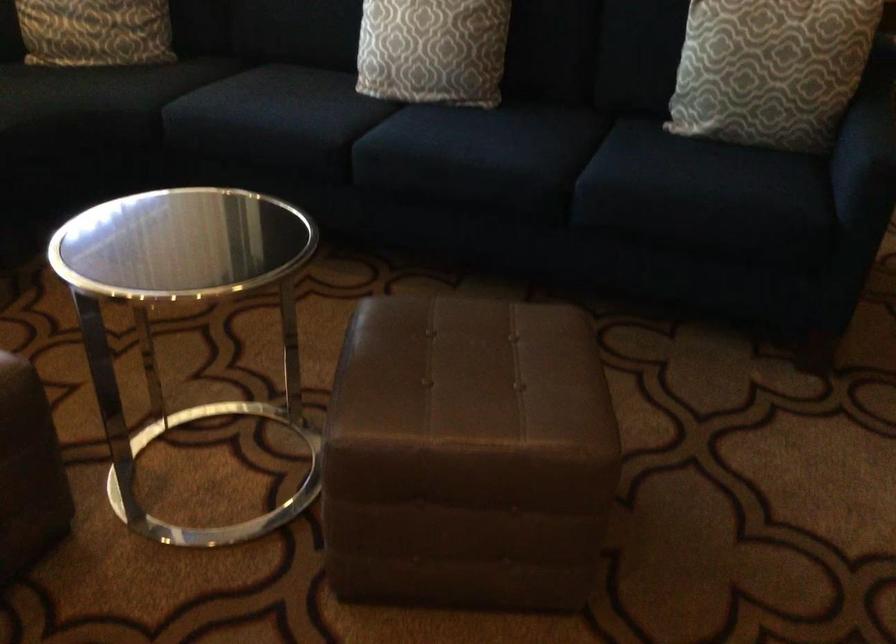
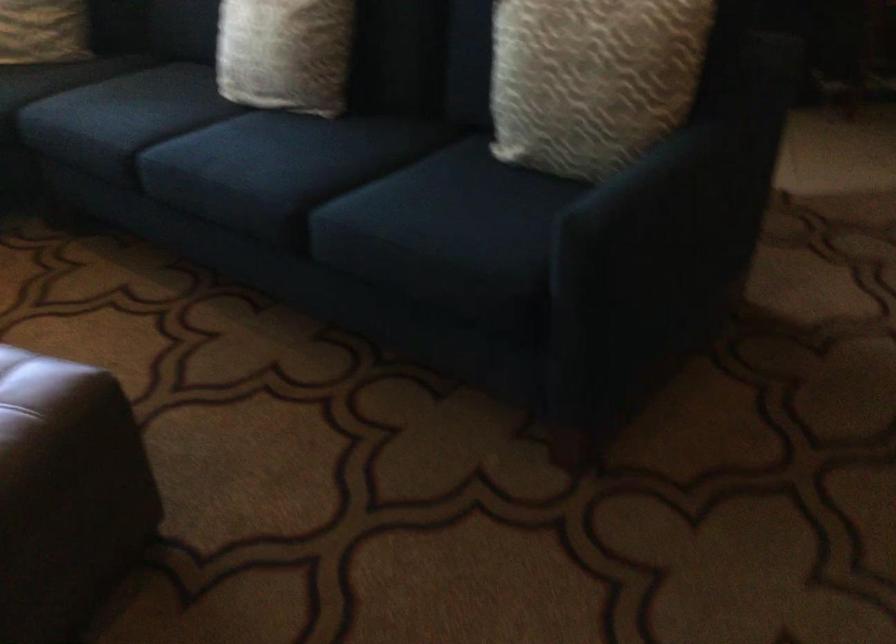
What movement of the cameraman would produce the second image?

The movement direction of the cameraman is right, forward.